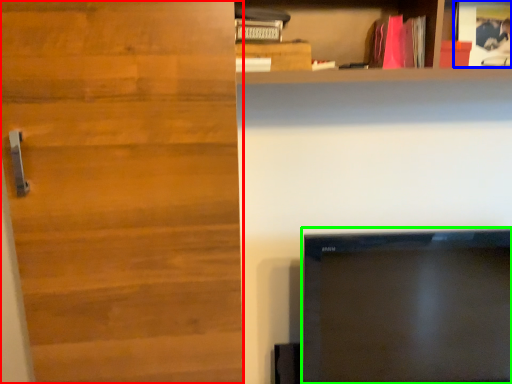
Question: Which object is positioned closest to door (highlighted by a red box)? Select from book (highlighted by a blue box) and television (highlighted by a green box).

Choices:
 (A) book
 (B) television

Answer: (B)